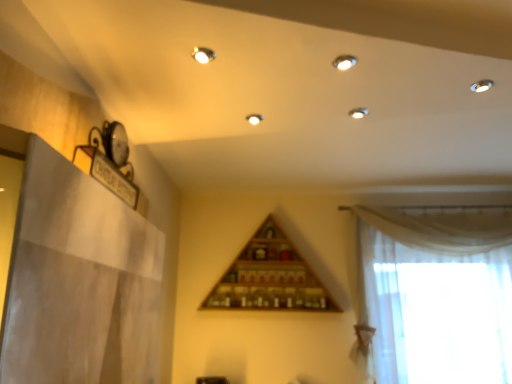
Question: In terms of width, does white sheer curtain at right look wider or thinner when compared to wooden triangle at center?

Choices:
 (A) wide
 (B) thin

Answer: (B)

Question: Is white sheer curtain at right situated inside wooden triangle at center or outside?

Choices:
 (A) outside
 (B) inside

Answer: (A)

Question: From the image's perspective, relative to wooden triangle at center, is white sheer curtain at right above or below?

Choices:
 (A) below
 (B) above

Answer: (A)

Question: From the image's perspective, relative to white sheer curtain at right, is wooden triangle at center above or below?

Choices:
 (A) above
 (B) below

Answer: (A)

Question: Is wooden triangle at center bigger or smaller than white sheer curtain at right?

Choices:
 (A) small
 (B) big

Answer: (A)

Question: Is wooden triangle at center to the left or to the right of white sheer curtain at right in the image?

Choices:
 (A) right
 (B) left

Answer: (B)

Question: In the image, is wooden triangle at center positioned in front of or behind white sheer curtain at right?

Choices:
 (A) behind
 (B) front

Answer: (A)